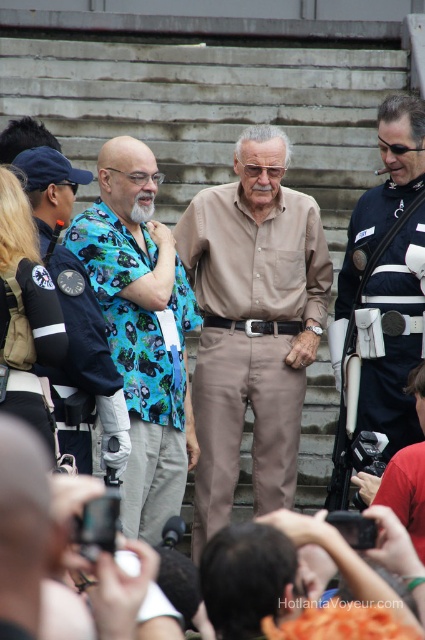
Question: Considering the real-world distances, which object is farthest from the blue floral shirt at center?

Choices:
 (A) blue printed shirt at center
 (B) matte khaki pants at center

Answer: (B)

Question: Which object appears farthest from the camera in this image?

Choices:
 (A) blue floral shirt at center
 (B) black plastic video camera at center
 (C) blue printed shirt at center

Answer: (C)

Question: Does blue printed shirt at center appear on the right side of black plastic video camera at center?

Choices:
 (A) no
 (B) yes

Answer: (A)

Question: Which of the following is the closest to the observer?

Choices:
 (A) black plastic video camera at center
 (B) dark blue uniform at right
 (C) blue floral shirt at center

Answer: (A)

Question: In this image, where is matte khaki pants at center located relative to blue printed shirt at center?

Choices:
 (A) right
 (B) left

Answer: (A)

Question: Is dark blue uniform at right positioned at the back of blue floral shirt at center?

Choices:
 (A) no
 (B) yes

Answer: (B)